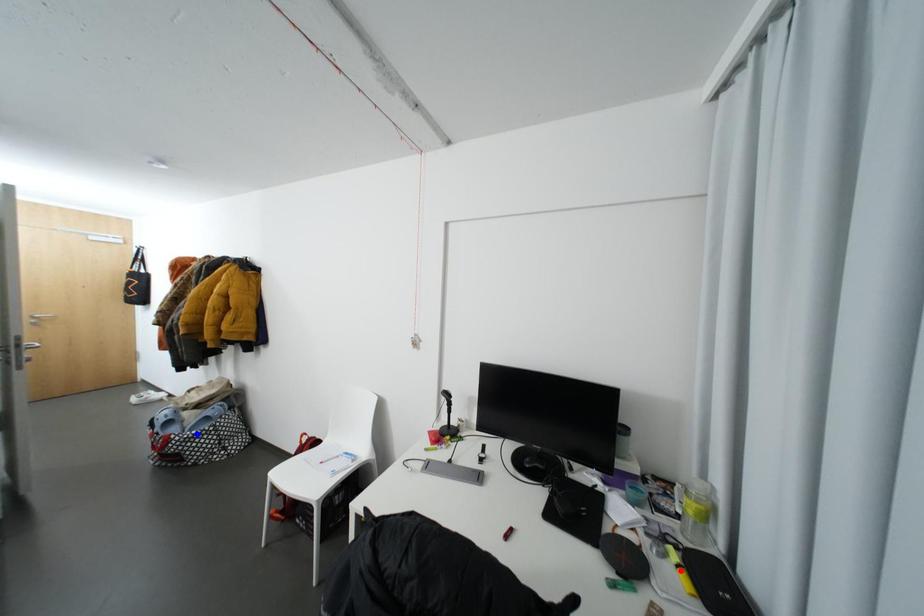
Question: In the image, two points are highlighted. Which point is nearer to the camera? Reply with the corresponding letter.

Choices:
 (A) blue point
 (B) red point

Answer: (B)